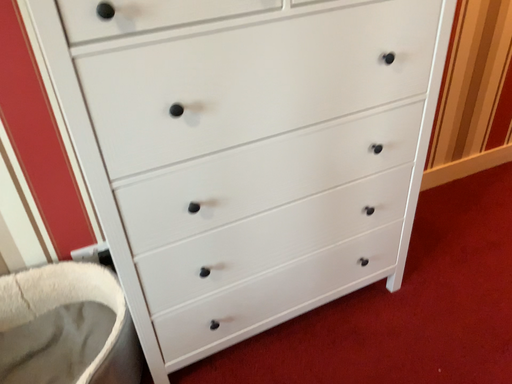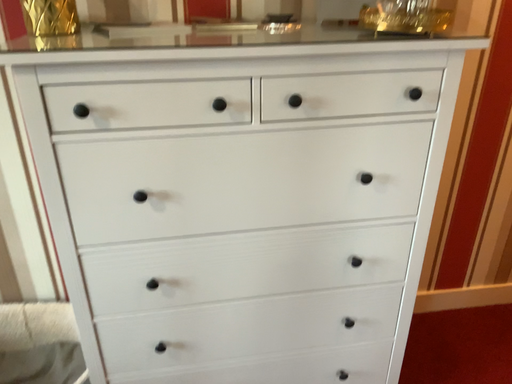
Question: Which way did the camera rotate in the video?

Choices:
 (A) rotated upward
 (B) rotated downward

Answer: (A)